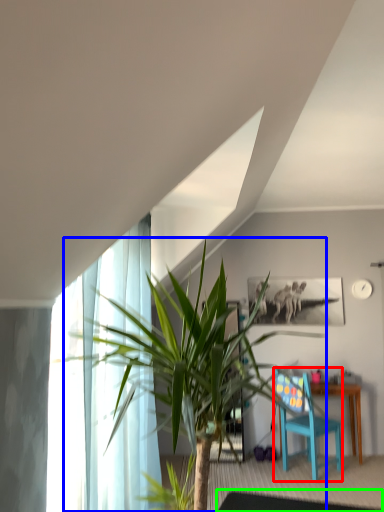
Question: Which object is positioned closest to chair (highlighted by a red box)? Select from houseplant (highlighted by a blue box) and glass table (highlighted by a green box).

Choices:
 (A) houseplant
 (B) glass table

Answer: (B)